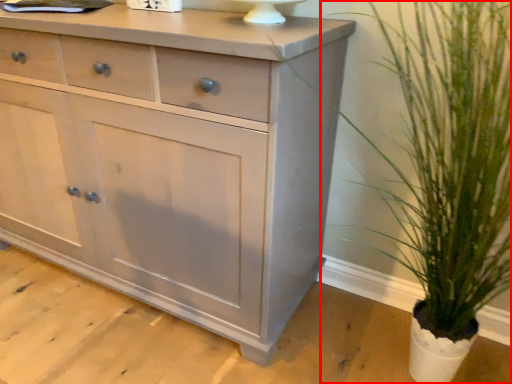
Question: From the image's perspective, what is the correct spatial positioning of houseplant (annotated by the red box) in reference to chest of drawers?

Choices:
 (A) below
 (B) above

Answer: (A)